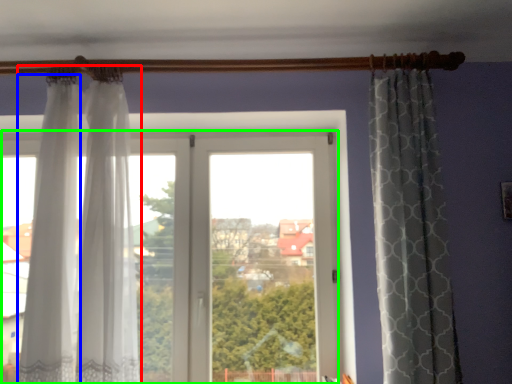
Question: Which is nearer to the curtain (highlighted by a red box)? curtain (highlighted by a blue box) or window (highlighted by a green box).

Choices:
 (A) curtain
 (B) window

Answer: (A)